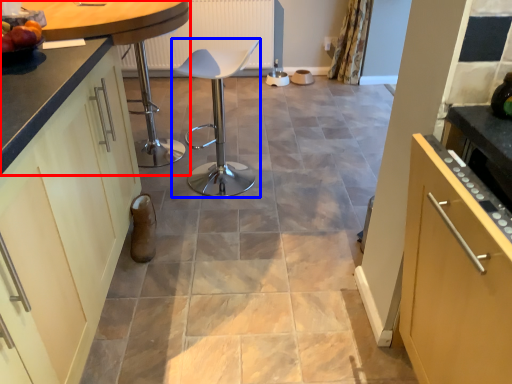
Question: Among these objects, which one is farthest to the camera, countertop (highlighted by a red box) or chair (highlighted by a blue box)?

Choices:
 (A) countertop
 (B) chair

Answer: (B)